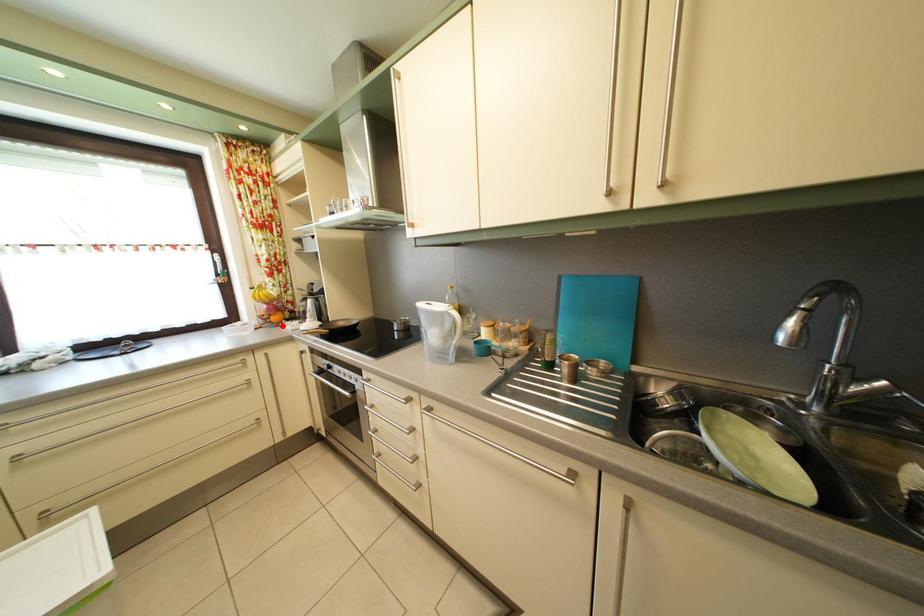
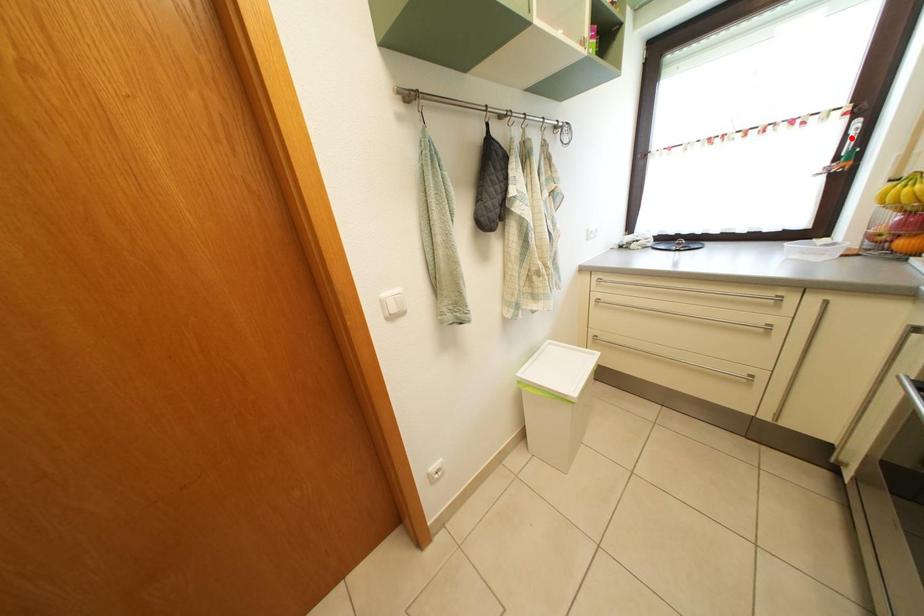
I am providing you with two images of the same scene from different viewpoints. A red point is marked on the first image and another point is marked on the second image. Is the red point in image1 aligned with the point shown in image2?

No